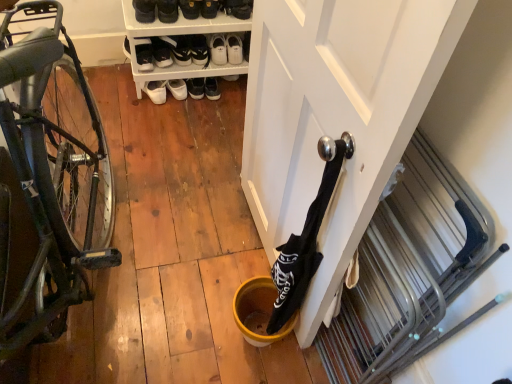
Where is `free space in front of white plastic shoe rack at upper center`? The height and width of the screenshot is (384, 512). free space in front of white plastic shoe rack at upper center is located at coordinates (170, 127).